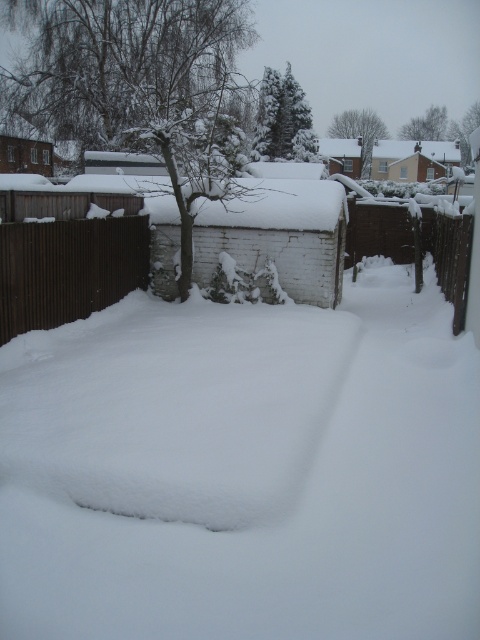
You are standing in the snowy backyard and see the brown wooden fence at left and the brown wooden fence at right. Which fence is closer to the shed behind them?

The brown wooden fence at left is closer to the shed behind them because it is positioned to the left of the brown wooden fence at right, and since the shed is behind the fences, the left fence would be nearer.